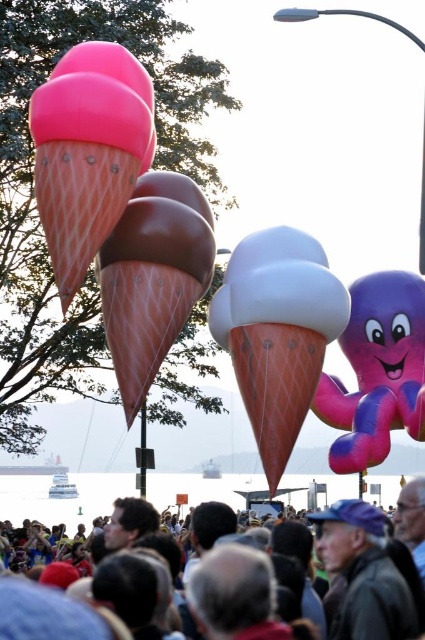
You are a photographer trying to capture both the pink matte ice cream cone at upper left and the white matte ice cream cone at center in a single frame. Based on their positions, which ice cream cone should you adjust your camera angle to focus on first to ensure both are in the shot?

The pink matte ice cream cone at upper left is positioned on the left side of white matte ice cream cone at center. To capture both in a single frame, you should adjust your camera angle to focus on the pink matte ice cream cone at upper left first, as it is on the left, ensuring the white one remains within the right side of the frame.

You are at a festival and looking up at the balloons. You see the pink matte ice cream cone at upper left and the matte pink ice cream cone at center. Which one is positioned to the right of the other?

The pink matte ice cream cone at upper left is to the right of the matte pink ice cream cone at center.

You are a photographer trying to capture both the pink matte ice cream cone at upper left and the white matte ice cream cone at center in a single shot. Given that your camera frame can only accommodate objects up to the size of the larger one, will both fit if you position them side by side?

The pink matte ice cream cone at upper left is wider than the white matte ice cream cone at center. Since the camera frame can fit up to the size of the larger one, both can be positioned side by side within the frame as their combined width would not exceed the frame capacity.